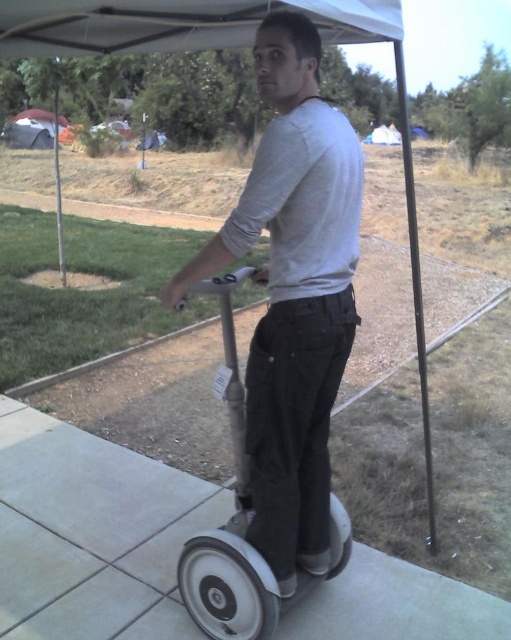
Question: Which object is positioned closest to the silver metallic wheel at lower center?

Choices:
 (A) metallic pole at upper right
 (B) silver metallic scooter at center
 (C) white canvas tent at upper center

Answer: (B)

Question: Is white smooth pavement at center thinner than orange fabric tent at upper left?

Choices:
 (A) yes
 (B) no

Answer: (A)

Question: From the image, what is the correct spatial relationship of silver metallic scooter at center in relation to silver metallic wheel at lower center?

Choices:
 (A) right
 (B) left

Answer: (A)

Question: Which point is closer to the camera?

Choices:
 (A) (222, 369)
 (B) (373, 138)
 (C) (428, 497)

Answer: (A)

Question: Which object is farther from the camera taking this photo?

Choices:
 (A) silver metallic wheel at lower center
 (B) silver metallic scooter at center
 (C) white smooth pavement at center

Answer: (C)

Question: Can you confirm if white fabric canopy at upper center is thinner than orange fabric tent at upper left?

Choices:
 (A) yes
 (B) no

Answer: (B)